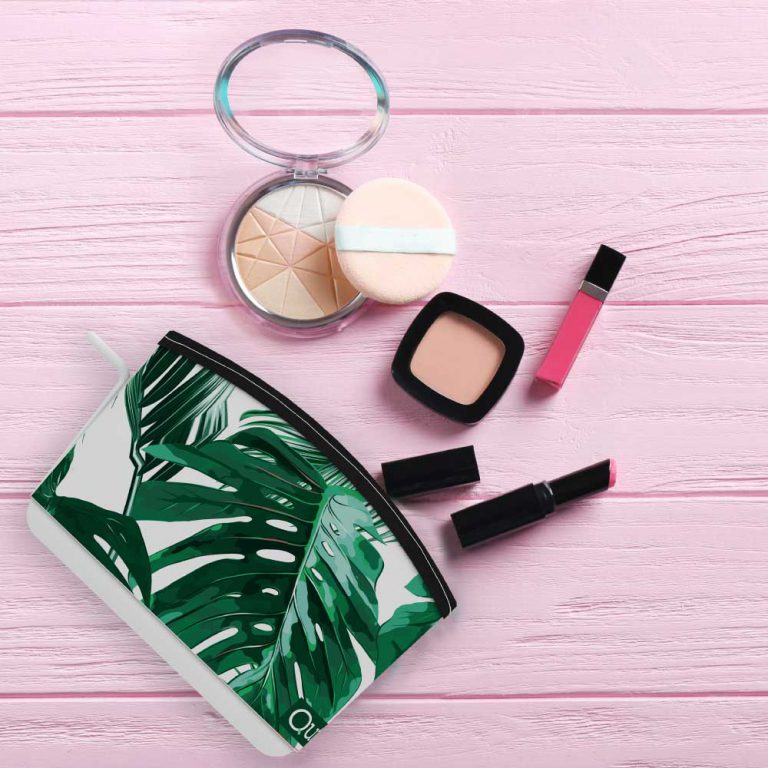
Identify the location of pink table. (654, 131).